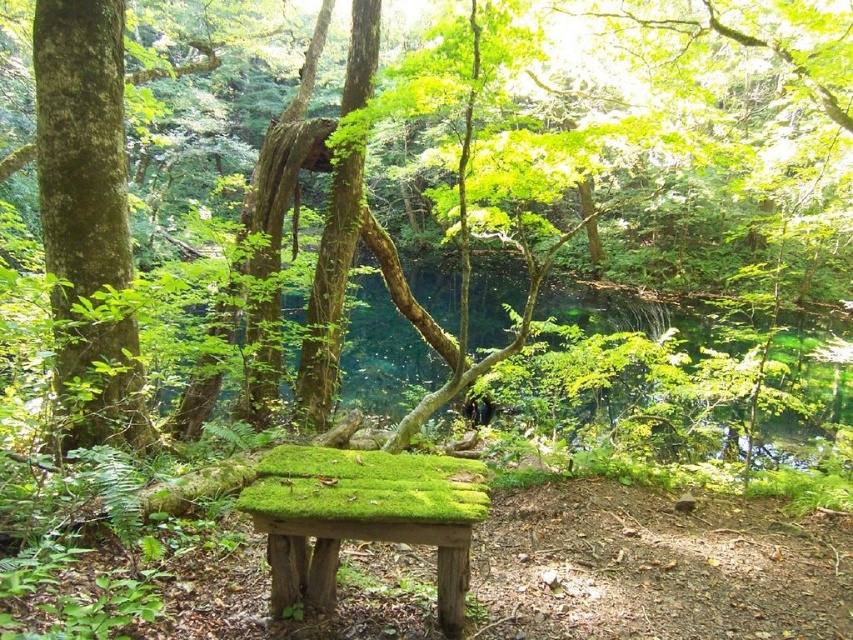
Question: Among these points, which one is nearest to the camera?

Choices:
 (A) (300, 564)
 (B) (71, 33)

Answer: (A)

Question: Does green mossy bench at center come behind green mossy wood bench at center?

Choices:
 (A) no
 (B) yes

Answer: (B)

Question: Where is green mossy tree at left located in relation to green mossy wood bench at center in the image?

Choices:
 (A) above
 (B) below

Answer: (A)

Question: Which point appears closest to the camera in this image?

Choices:
 (A) (271, 540)
 (B) (64, 234)
 (C) (88, 438)

Answer: (A)

Question: Which point is farther to the camera?

Choices:
 (A) green mossy wood bench at center
 (B) green mossy tree at left

Answer: (B)

Question: Is green mossy tree at left above green mossy wood bench at center?

Choices:
 (A) yes
 (B) no

Answer: (A)